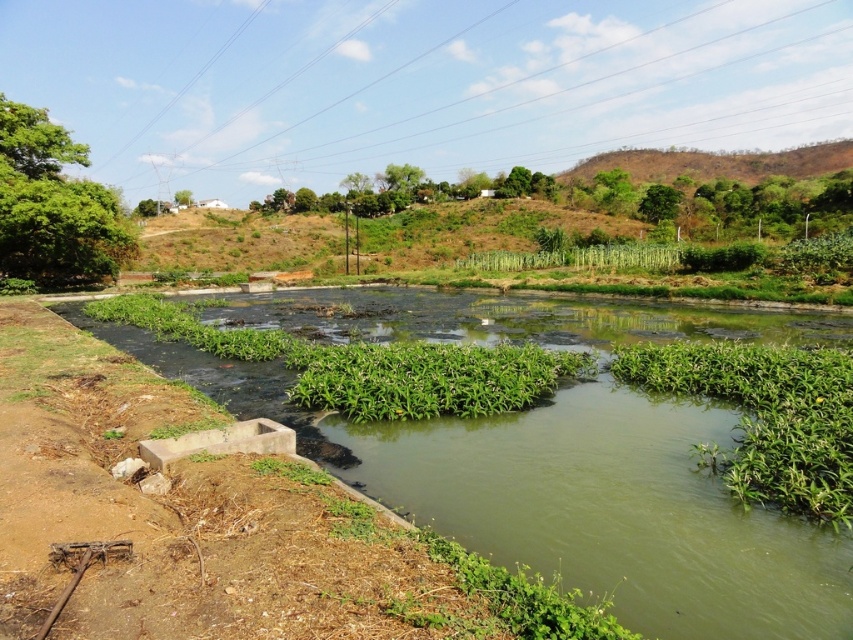
Consider the image. You are a photographer planning to capture the rural landscape. You notice the clear plastic power lines at upper center and the brown dry grass at upper right. Which object is wider in the image?

The clear plastic power lines at upper center are wider than the brown dry grass at upper right.

You are a bird flying over the rural landscape shown in the image. You need to land on either the clear plastic power lines at upper center or the brown dry grass at upper right. Which location would provide a more stable landing surface based on their sizes?

The clear plastic power lines at upper center has a larger size compared to the brown dry grass at upper right, so it would provide a more stable landing surface for the bird.